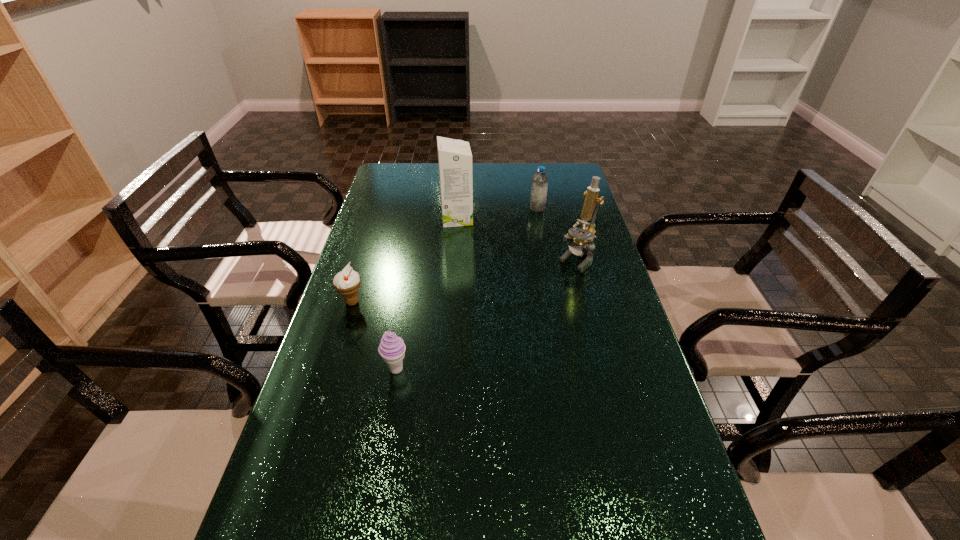
Where is `blank space located 0.180m on the front of the microscope`? blank space located 0.180m on the front of the microscope is located at coordinates (590, 312).

This screenshot has width=960, height=540. Find the location of `free space located on the back of the third shortest object`. free space located on the back of the third shortest object is located at coordinates (531, 174).

Locate an element on the screen. This screenshot has height=540, width=960. vacant region located on the front of the farther icecream is located at coordinates (326, 385).

This screenshot has width=960, height=540. In order to click on blank space located on the right of the right icecream in this screenshot , I will do `click(552, 369)`.

Find the location of a particular element. object at the left edge is located at coordinates (347, 282).

Where is `object positioned at the right edge`? The image size is (960, 540). object positioned at the right edge is located at coordinates (579, 236).

In the image, there is a desktop. Where is `vacant space at the far edge`? The height and width of the screenshot is (540, 960). vacant space at the far edge is located at coordinates (538, 170).

The height and width of the screenshot is (540, 960). I want to click on vacant space at the left edge of the desktop, so coord(393,234).

Image resolution: width=960 pixels, height=540 pixels. I want to click on vacant space at the right edge, so click(641, 424).

The width and height of the screenshot is (960, 540). In the image, there is a desktop. In order to click on vacant region at the far left corner in this screenshot , I will do pos(409,178).